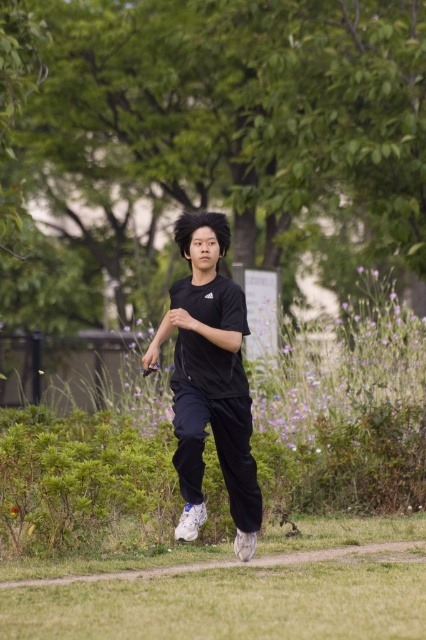
You are a drone operator trying to capture a photo of the person jogging. The green grass at lower center is where the person is currently stepping. To ensure the photo includes the signpost in the background, should you adjust the drone camera upwards or downwards?

Since the green grass at lower center is located at point [221,598], which is lower in the image, adjusting the drone camera upwards would bring the signpost, which is behind and likely higher in the frame, into the shot.

You are a photographer trying to capture the jogger in the image. You notice the black matte shirt at center and the green grass at lower center. Which object should you focus on first if you want to ensure the jogger is in sharp focus?

The black matte shirt at center should be focused on first because it is behind the green grass at lower center, meaning it is farther away from the camera. To ensure the jogger is in sharp focus, you need to focus on the part of the subject that is farthest from the camera, which in this case is the black matte shirt at center.